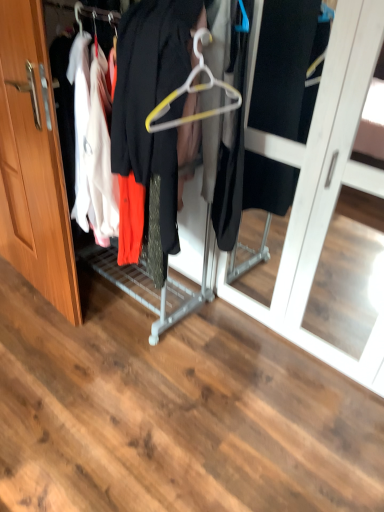
Question: From their relative heights in the image, would you say wooden door at left is taller or shorter than white plastic hanger at center?

Choices:
 (A) tall
 (B) short

Answer: (A)

Question: From the image's perspective, is wooden door at left located above or below white plastic hanger at center?

Choices:
 (A) below
 (B) above

Answer: (A)

Question: Based on their relative distances, which object is nearer to the white plastic hanger at center?

Choices:
 (A) metallic hanger at center
 (B) wooden door at left

Answer: (A)

Question: Which of these objects is positioned farthest from the wooden door at left?

Choices:
 (A) white plastic hanger at center
 (B) metallic hanger at center

Answer: (A)